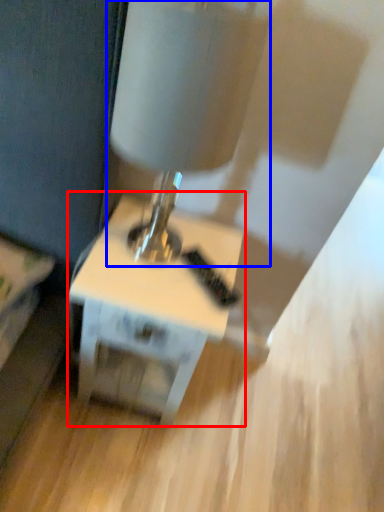
Question: Which object appears closest to the camera in this image, table (highlighted by a red box) or table lamp (highlighted by a blue box)?

Choices:
 (A) table
 (B) table lamp

Answer: (B)